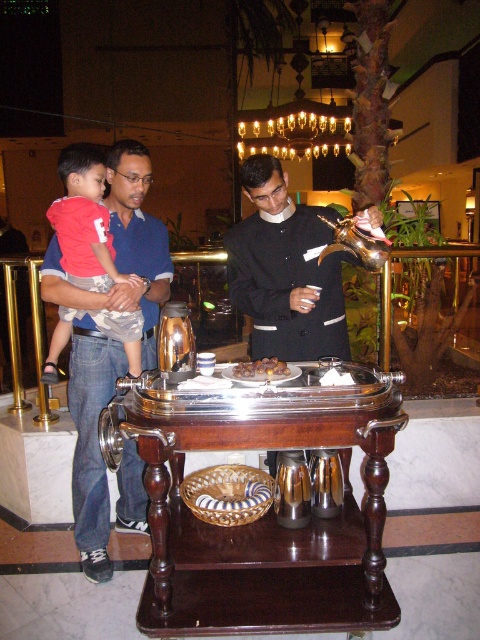
You are standing in the hotel lobby and need to locate the blue denim jeans at left. According to the coordinates provided, where would you find them in the image?

The blue denim jeans at left are located at the 2D coordinates point (123, 250) in the image.

You are a photographer trying to capture a candid shot of the blue denim jeans at left and the matte red shirt at left in the hotel lobby scene. Since you want to ensure both subjects are fully visible in the frame, which subject should you focus on first to account for their height difference?

The blue denim jeans at left is taller than the matte red shirt at left, so you should focus on the blue denim jeans at left first to ensure both are in frame.